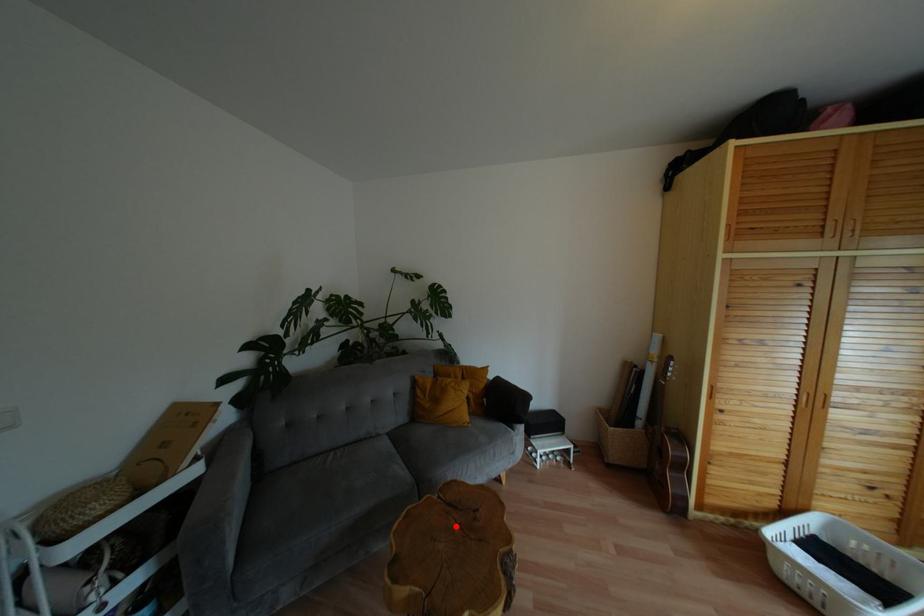
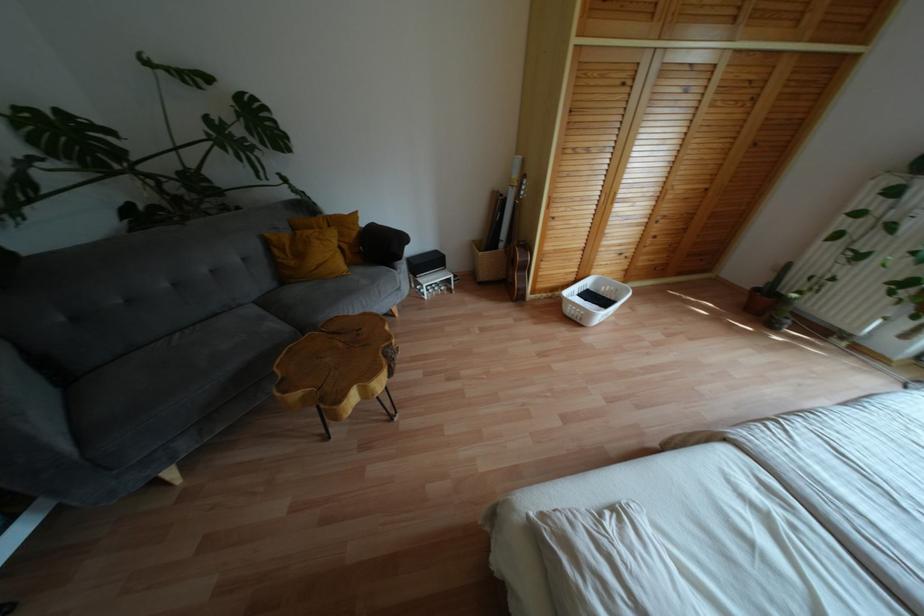
The point at the highlighted location is marked in the first image. Where is the corresponding point in the second image?

(341, 344)